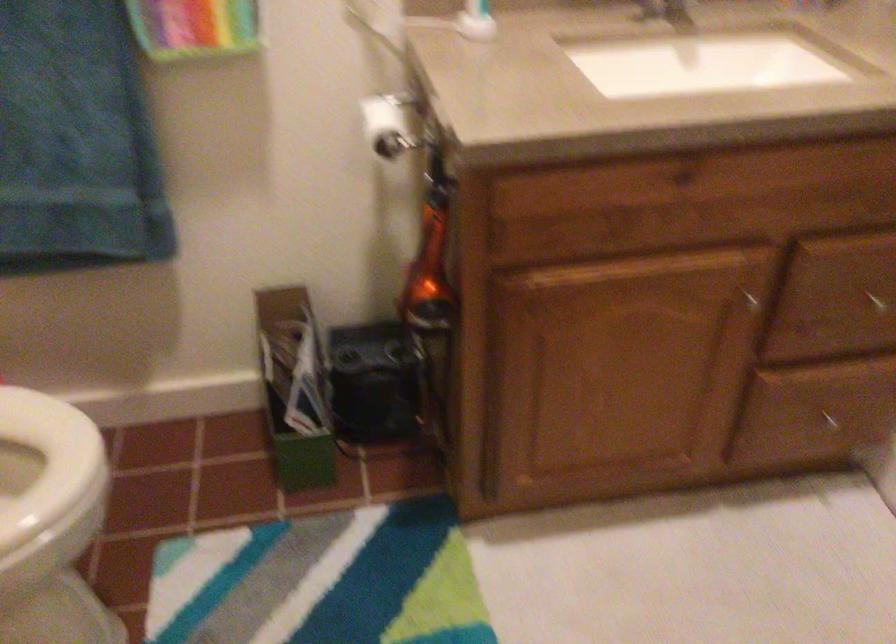
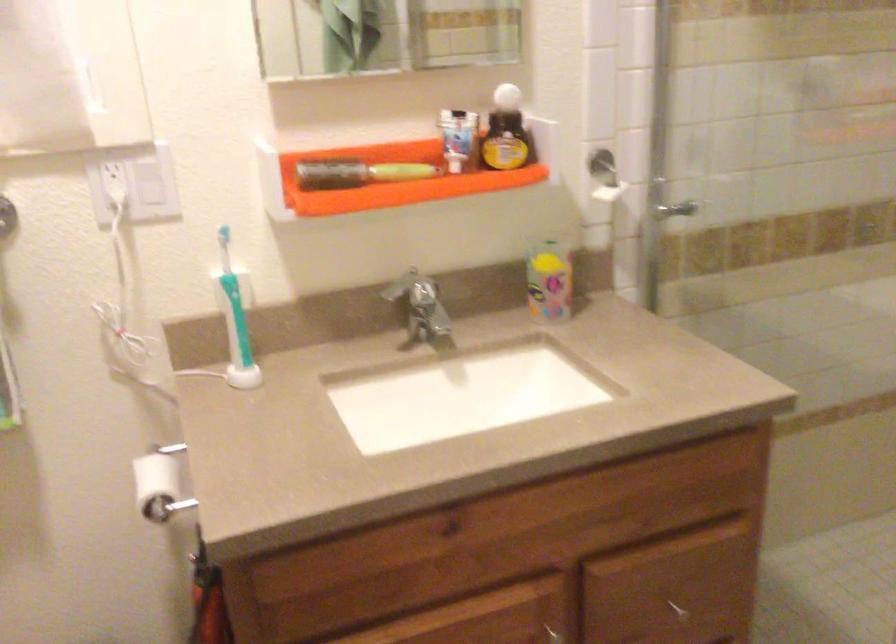
Find the pixel in the second image that matches pixel 388 120 in the first image.

(159, 484)